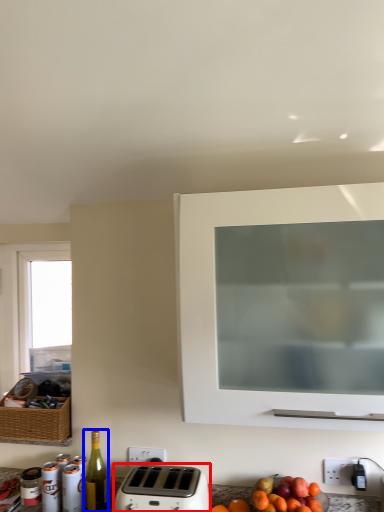
Question: Among these objects, which one is nearest to the camera, toaster (highlighted by a red box) or bottle (highlighted by a blue box)?

Choices:
 (A) toaster
 (B) bottle

Answer: (A)